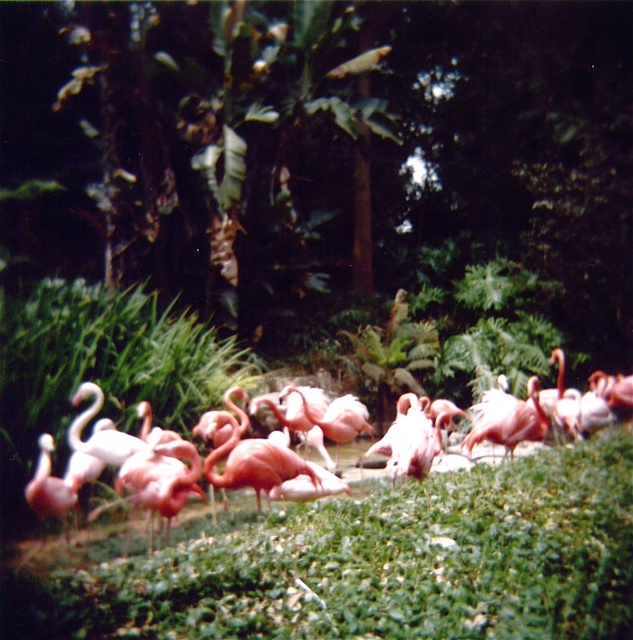
Can you confirm if pink matte flamingo at center is positioned to the left of pink matte flamingo at lower left?

Incorrect, pink matte flamingo at center is not on the left side of pink matte flamingo at lower left.

Between pink matte flamingo at center and pink matte flamingo at lower left, which one appears on the right side from the viewer's perspective?

pink matte flamingo at center

Does point (549, 451) come behind point (66, 508)?

Yes.

At what (x,y) coordinates should I click in order to perform the action: click on pink matte flamingo at center. Please return your answer as a coordinate pair (x, y). Looking at the image, I should click on (442, 538).

Between green leafy grass at center and pink matte flamingo at lower left, which one has more height?

Standing taller between the two is pink matte flamingo at lower left.

Does point (573, 547) come behind point (32, 500)?

No.

The image size is (633, 640). In order to click on green leafy grass at center in this screenshot , I will do `click(380, 564)`.

Between green leafy grass at center and pink matte flamingo at center, which one appears on the right side from the viewer's perspective?

pink matte flamingo at center

Is point (229, 580) more distant than point (618, 522)?

That is False.

This screenshot has height=640, width=633. I want to click on green leafy grass at center, so click(380, 564).